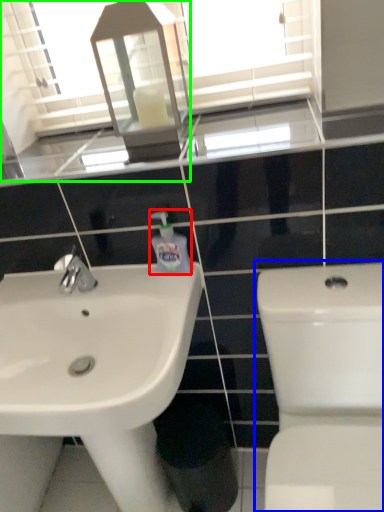
Question: Considering the real-world distances, which object is farthest from cleaning product (highlighted by a red box)? toilet (highlighted by a blue box) or mirror (highlighted by a green box)?

Choices:
 (A) toilet
 (B) mirror

Answer: (B)